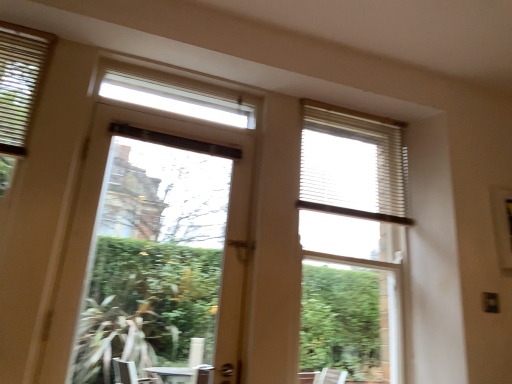
Question: Is point (117, 139) closer or farther from the camera than point (324, 115)?

Choices:
 (A) farther
 (B) closer

Answer: (B)

Question: From their relative heights in the image, would you say clear glass window at left is taller or shorter than white textured blind at upper right?

Choices:
 (A) short
 (B) tall

Answer: (B)

Question: Estimate the real-world distances between objects in this image. Which object is farther from the clear glass window at left?

Choices:
 (A) white textured blinds at upper right
 (B) white textured blind at upper right
 (C) matte white blinds at upper left

Answer: (C)

Question: Which object is positioned closest to the white textured blind at upper right?

Choices:
 (A) clear glass window at left
 (B) matte white blinds at upper left
 (C) white textured blinds at upper right

Answer: (C)